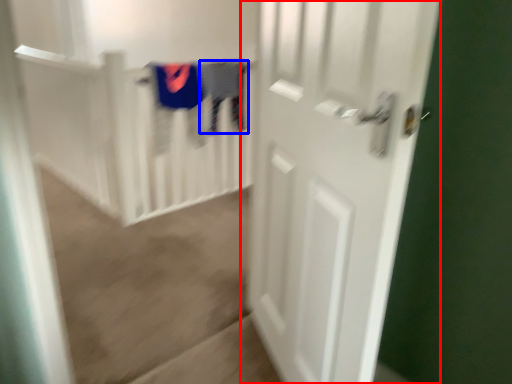
Question: Which of the following is the farthest to the observer, door (highlighted by a red box) or clothing (highlighted by a blue box)?

Choices:
 (A) door
 (B) clothing

Answer: (B)